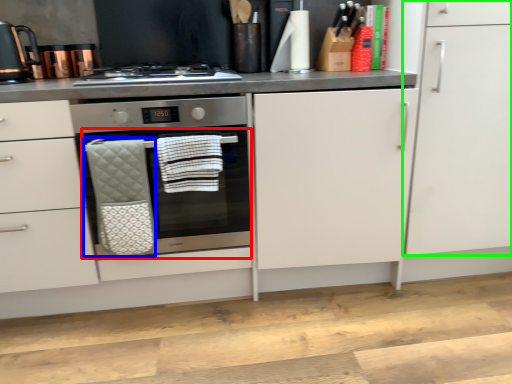
Question: Considering the real-world distances, which object is farthest from oven (highlighted by a red box)? hand towel (highlighted by a blue box) or cabinetry (highlighted by a green box)?

Choices:
 (A) hand towel
 (B) cabinetry

Answer: (B)